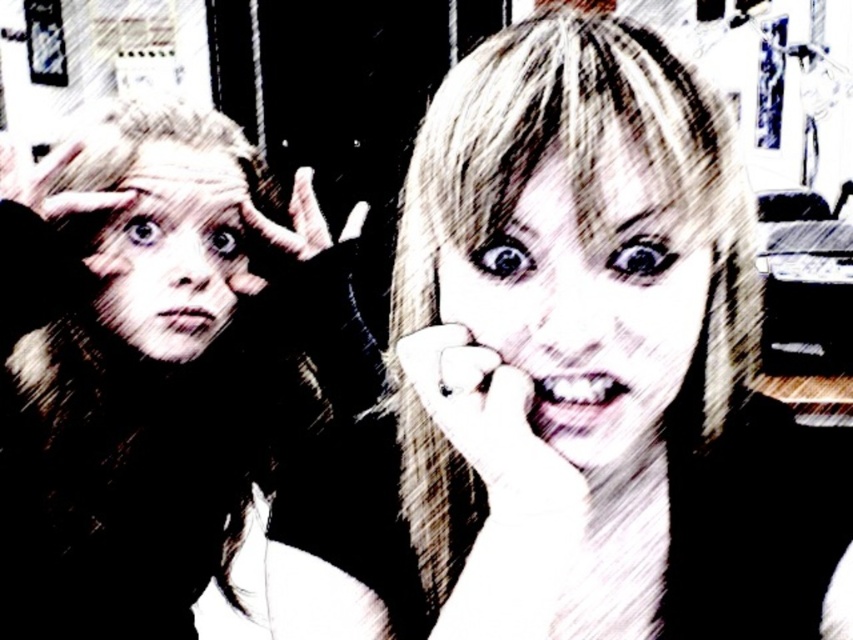
You are an artist analyzing the composition of the image. You notice a point at coordinates (587,300). What object is located at that point?

The point at coordinates (587,300) is where the smooth skin face at center is located.

You are a photographer analyzing the image for a portrait project. You notice the smooth skin face at center and the black leather hand at center. Based on their sizes in the image, which object would appear closer to the camera? Please explain your reasoning.

The smooth skin face at center is much taller than the black leather hand at center. In photography, objects that appear larger in the frame are typically closer to the camera. Therefore, the smooth skin face at center likely appears closer to the camera than the black leather hand at center.

You are viewing the image and want to determine which of the two points, point (474, 307) or point (135, 266), is nearer to the camera. Based on the scene description, which point is closer?

Point (474, 307) is closer to the camera than point (135, 266).